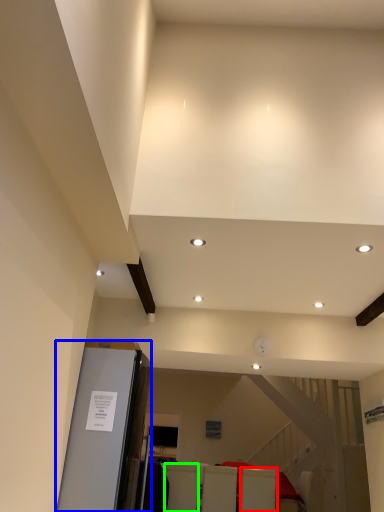
Question: Considering the real-world distances, which object is farthest from furniture (highlighted by a red box)? elevator (highlighted by a blue box) or furniture (highlighted by a green box)?

Choices:
 (A) elevator
 (B) furniture

Answer: (A)